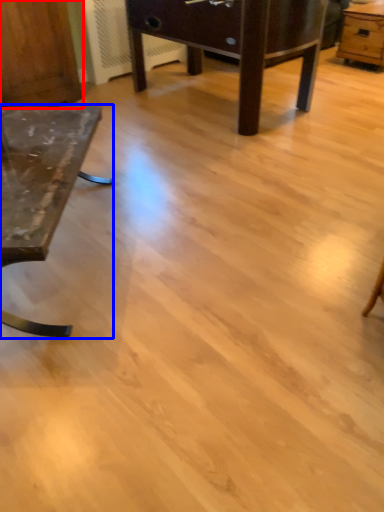
Question: Which object is closer to the camera taking this photo, dresser (highlighted by a red box) or table (highlighted by a blue box)?

Choices:
 (A) dresser
 (B) table

Answer: (B)